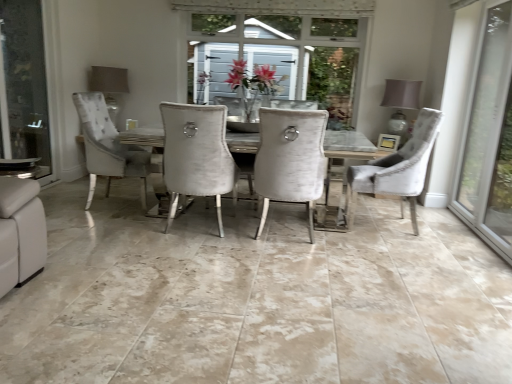
Find the location of `vacant area situated below transparent glass door at right (from a real-world perspective)`. vacant area situated below transparent glass door at right (from a real-world perspective) is located at coordinates (462, 224).